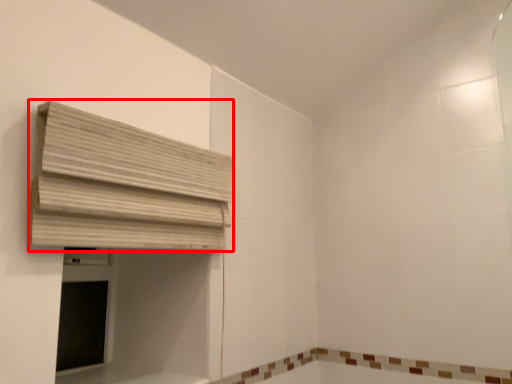
Question: From the image's perspective, where is curtain (annotated by the red box) located in relation to bath in the image?

Choices:
 (A) below
 (B) above

Answer: (B)